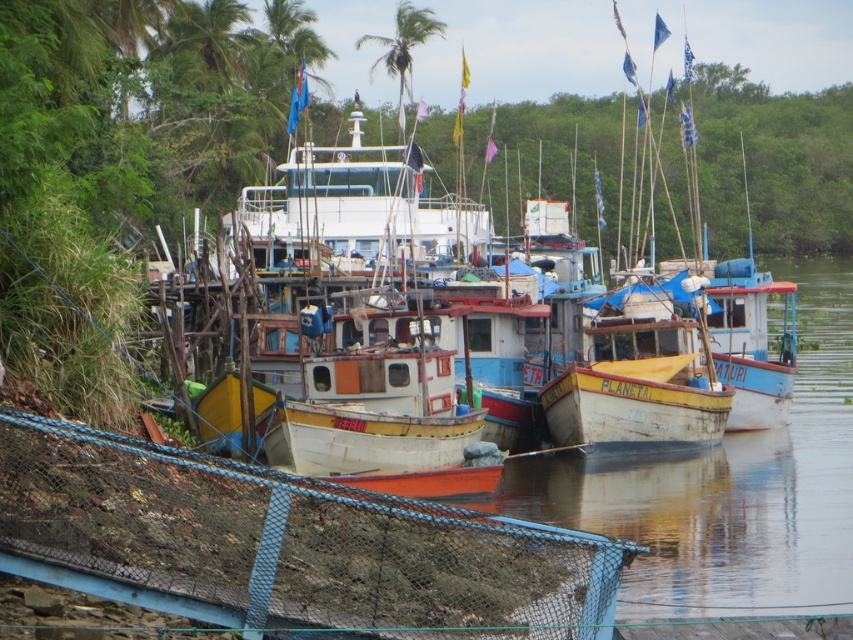
Is point (158, 605) less distant than point (401, 96)?

Yes, it is.

Does point (84, 504) come behind point (396, 44)?

No, (84, 504) is in front of (396, 44).

Where is `blue mesh net at lower left`? blue mesh net at lower left is located at coordinates (283, 545).